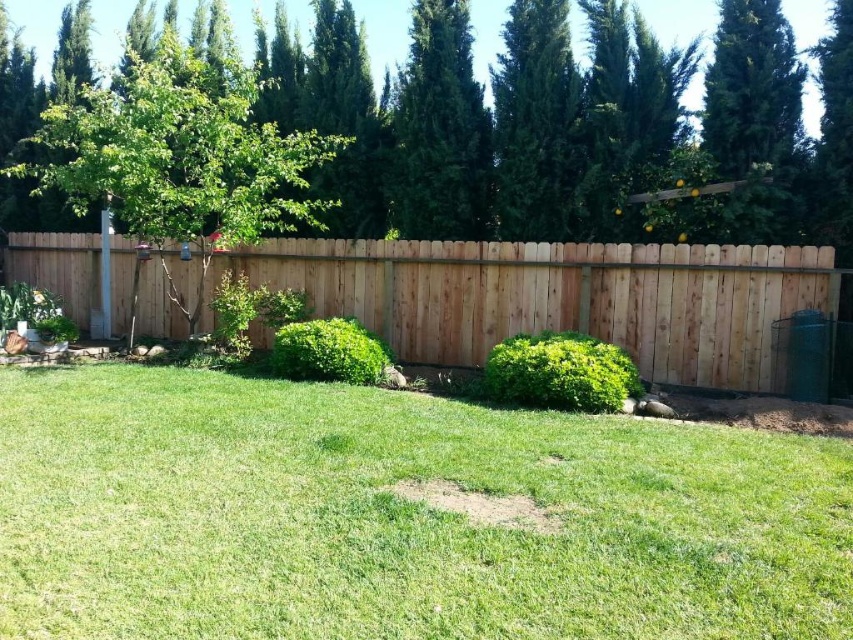
Question: Estimate the real-world distances between objects in this image. Which object is closer to the green leafy tree at left?

Choices:
 (A) green grass at center
 (B) natural wood fence at center
 (C) green textured tree at upper center
 (D) green leafy tree at upper center

Answer: (B)

Question: Which is nearer to the green grass at center?

Choices:
 (A) green leafy tree at left
 (B) natural wood fence at center
 (C) green textured tree at upper center

Answer: (B)

Question: Does green leafy tree at upper center lie in front of natural wood fence at center?

Choices:
 (A) no
 (B) yes

Answer: (A)

Question: From the image, what is the correct spatial relationship of green grass at center in relation to green leafy tree at left?

Choices:
 (A) above
 (B) below

Answer: (B)

Question: Can you confirm if green leafy tree at upper center is smaller than green leafy tree at left?

Choices:
 (A) no
 (B) yes

Answer: (B)

Question: Which object is positioned farthest from the green leafy tree at upper center?

Choices:
 (A) green leafy tree at left
 (B) green grass at center
 (C) natural wood fence at center
 (D) green textured tree at upper center

Answer: (B)